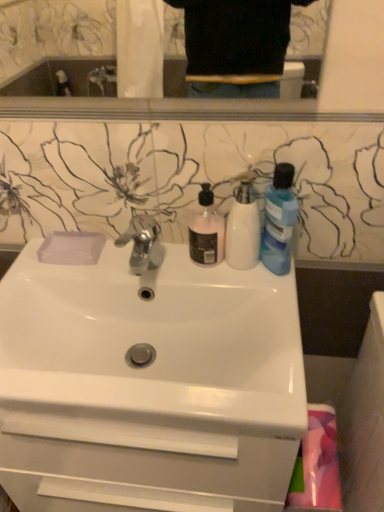
Image resolution: width=384 pixels, height=512 pixels. I want to click on free space that is to the left of pink matte liquid soap at center, which is the 3th cleaning product from right to left, so click(x=148, y=259).